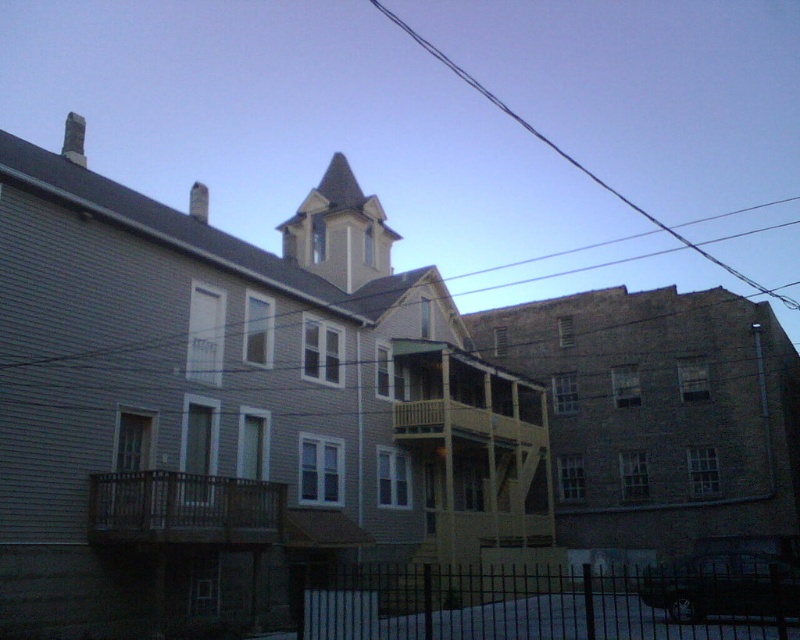
Question: Which of the following is the closest to the observer?

Choices:
 (A) black wire at upper center
 (B) brown brick church at center

Answer: (B)

Question: Which object is the closest to the black wire at upper center?

Choices:
 (A) brown brick church at center
 (B) gray siding church at center

Answer: (A)

Question: Is brown brick church at center thinner than black wire at upper center?

Choices:
 (A) yes
 (B) no

Answer: (A)

Question: Which is farther from the gray siding church at center?

Choices:
 (A) black wire at upper center
 (B) brown brick church at center

Answer: (A)

Question: From the image, what is the correct spatial relationship of gray siding church at center in relation to black wire at upper center?

Choices:
 (A) above
 (B) below

Answer: (B)

Question: Is gray siding church at center positioned before brown brick church at center?

Choices:
 (A) yes
 (B) no

Answer: (A)